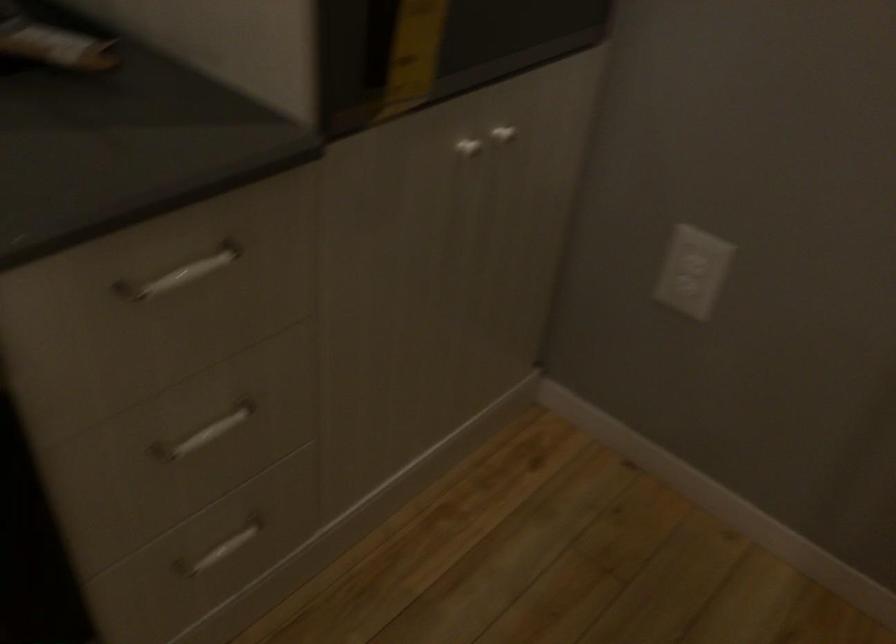
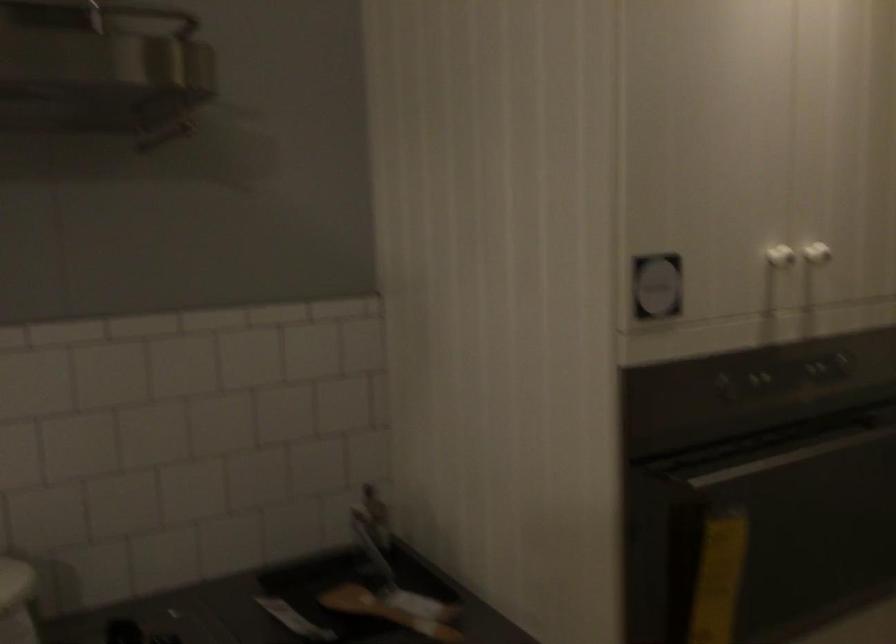
Based on the continuous images, in which direction is the camera rotating?

The camera rotated toward left-up.